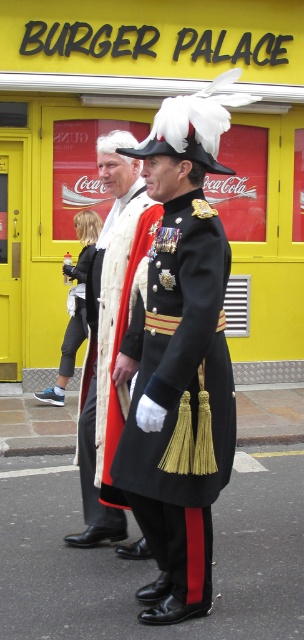
Question: Among these points, which one is nearest to the camera?

Choices:
 (A) (234, 106)
 (B) (72, 333)
 (C) (141, 460)

Answer: (C)

Question: Which of these objects is positioned farthest from the matte white scarf at center?

Choices:
 (A) white feathered hat at center
 (B) matte black coat at center
 (C) shiny black fabric coat at center

Answer: (B)

Question: Can you confirm if matte white scarf at center is positioned above matte black coat at center?

Choices:
 (A) no
 (B) yes

Answer: (A)

Question: Does shiny black fabric coat at center have a lesser width compared to matte black coat at center?

Choices:
 (A) yes
 (B) no

Answer: (B)

Question: Can you confirm if matte white scarf at center is smaller than white feathered hat at center?

Choices:
 (A) no
 (B) yes

Answer: (A)

Question: Which point appears closest to the camera in this image?

Choices:
 (A) (238, 99)
 (B) (179, 310)
 (C) (117, 230)
 (D) (65, 369)

Answer: (B)